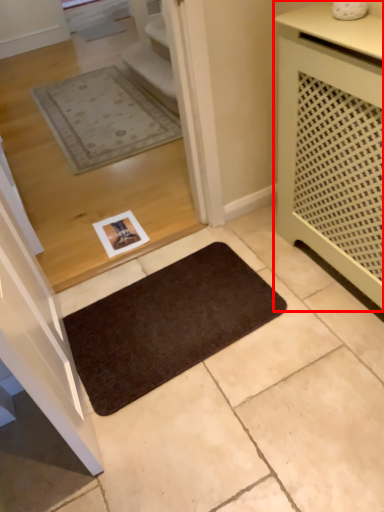
Question: Observing the image, what is the correct spatial positioning of cabinetry (annotated by the red box) in reference to mat?

Choices:
 (A) right
 (B) left

Answer: (A)